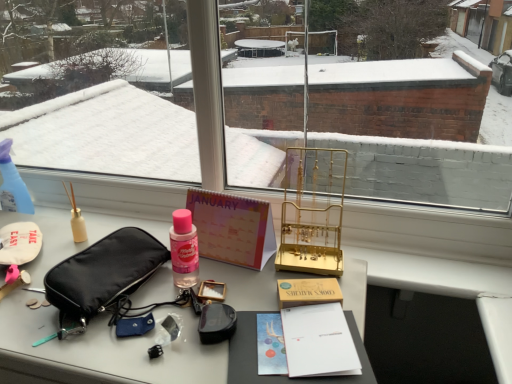
I want to click on unoccupied region to the right of transparent plastic spray bottle at left, so click(x=67, y=202).